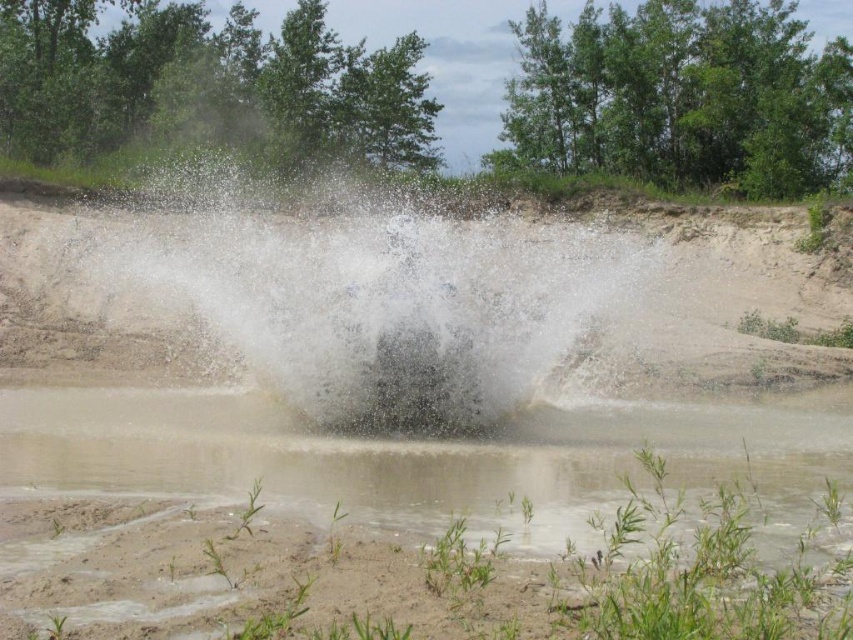
Question: Is the position of muddy water at center more distant than that of white frothy water at center?

Choices:
 (A) no
 (B) yes

Answer: (A)

Question: In this image, where is muddy water at center located relative to white frothy water at center?

Choices:
 (A) left
 (B) right

Answer: (B)

Question: Which point appears farthest from the camera in this image?

Choices:
 (A) (120, 419)
 (B) (582, 252)

Answer: (B)

Question: From the image, what is the correct spatial relationship of muddy water at center in relation to white frothy water at center?

Choices:
 (A) right
 (B) left

Answer: (A)